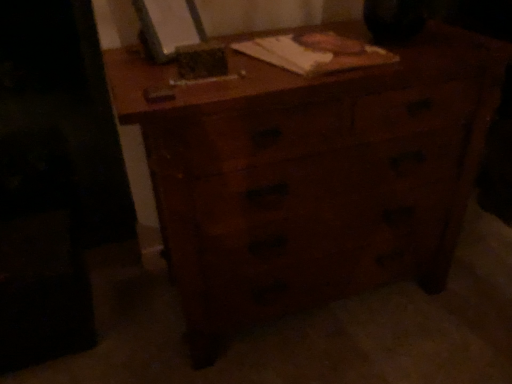
The height and width of the screenshot is (384, 512). Identify the location of spots to the right of wooden notebook at center. click(x=406, y=48).